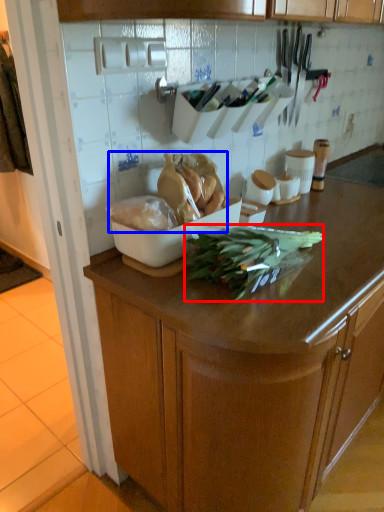
Question: Among these objects, which one is nearest to the camera, green vegetables (highlighted by a red box) or food (highlighted by a blue box)?

Choices:
 (A) green vegetables
 (B) food

Answer: (A)